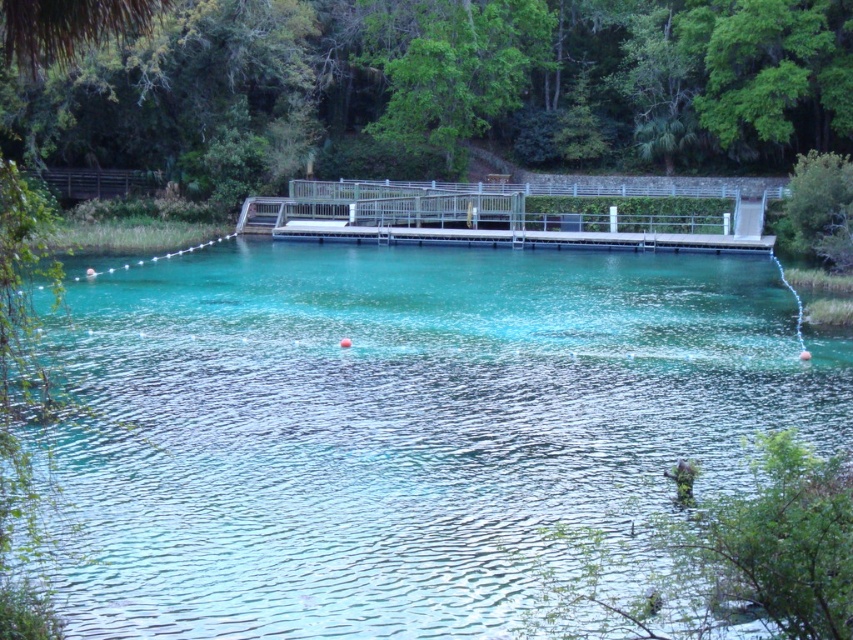
Question: Among these points, which one is nearest to the camera?

Choices:
 (A) (463, 422)
 (B) (527, 236)

Answer: (A)

Question: Is clear water at center to the right of metallic gray dock at center from the viewer's perspective?

Choices:
 (A) no
 (B) yes

Answer: (A)

Question: Does clear water at center come in front of metallic gray dock at center?

Choices:
 (A) yes
 (B) no

Answer: (A)

Question: Among these objects, which one is farthest from the camera?

Choices:
 (A) metallic gray dock at center
 (B) clear water at center

Answer: (A)

Question: Does clear water at center have a lesser width compared to metallic gray dock at center?

Choices:
 (A) yes
 (B) no

Answer: (B)

Question: Which of the following is the farthest from the observer?

Choices:
 (A) (640, 285)
 (B) (492, 224)

Answer: (B)